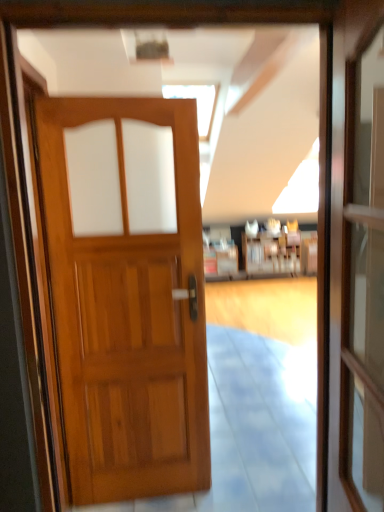
Question: Can transparent glass screen door at right be found inside wooden bookshelf at center?

Choices:
 (A) no
 (B) yes

Answer: (A)

Question: Is wooden bookshelf at center not within transparent glass screen door at right?

Choices:
 (A) yes
 (B) no

Answer: (A)

Question: Is wooden bookshelf at center taller than transparent glass screen door at right?

Choices:
 (A) yes
 (B) no

Answer: (B)

Question: Is transparent glass screen door at right at the back of wooden bookshelf at center?

Choices:
 (A) yes
 (B) no

Answer: (B)

Question: Does wooden bookshelf at center have a greater width compared to transparent glass screen door at right?

Choices:
 (A) yes
 (B) no

Answer: (A)

Question: Considering the positions of point (349, 250) and point (241, 271), is point (349, 250) closer or farther from the camera than point (241, 271)?

Choices:
 (A) farther
 (B) closer

Answer: (B)

Question: Do you think transparent glass screen door at right is within wooden bookshelf at center, or outside of it?

Choices:
 (A) outside
 (B) inside

Answer: (A)

Question: From the image's perspective, is transparent glass screen door at right above or below wooden bookshelf at center?

Choices:
 (A) below
 (B) above

Answer: (A)

Question: Based on their sizes in the image, would you say transparent glass screen door at right is bigger or smaller than wooden bookshelf at center?

Choices:
 (A) big
 (B) small

Answer: (B)

Question: In terms of height, does transparent glass screen door at right look taller or shorter compared to wooden door at center?

Choices:
 (A) tall
 (B) short

Answer: (B)

Question: In terms of width, does transparent glass screen door at right look wider or thinner when compared to wooden door at center?

Choices:
 (A) wide
 (B) thin

Answer: (B)

Question: Relative to wooden door at center, is transparent glass screen door at right in front or behind?

Choices:
 (A) front
 (B) behind

Answer: (A)

Question: Which is correct: transparent glass screen door at right is inside wooden door at center, or outside of it?

Choices:
 (A) outside
 (B) inside

Answer: (A)

Question: From a real-world perspective, is wooden door at center positioned above or below transparent glass screen door at right?

Choices:
 (A) below
 (B) above

Answer: (A)

Question: Is wooden door at center in front of or behind transparent glass screen door at right in the image?

Choices:
 (A) front
 (B) behind

Answer: (B)